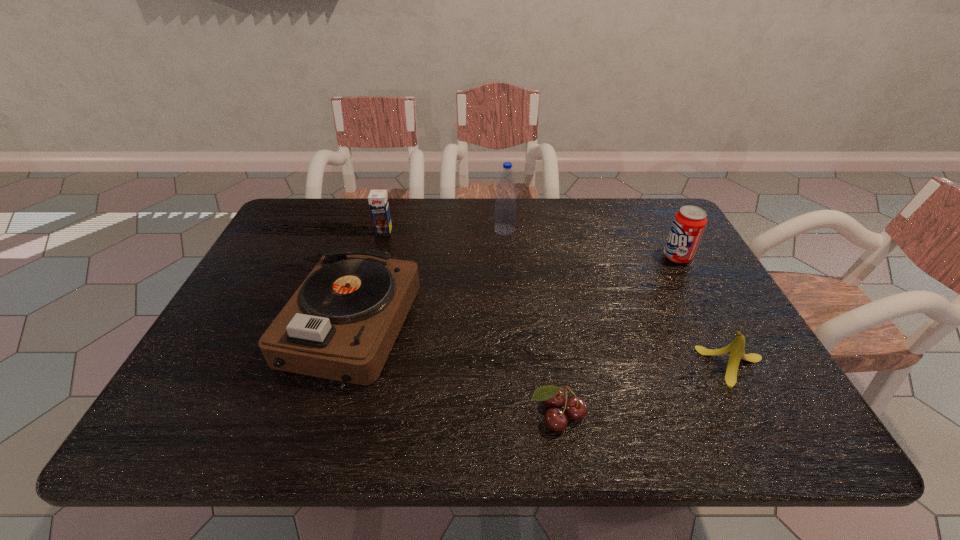
At what (x,y) coordinates should I click in order to perform the action: click on empty location between the record player and the banana. Please return your answer as a coordinate pair (x, y). Looking at the image, I should click on (543, 347).

The height and width of the screenshot is (540, 960). In order to click on free space between the banana and the third farthest object in this screenshot , I will do `click(707, 312)`.

Where is `unoccupied position between the banana and the chocolate milk`? This screenshot has height=540, width=960. unoccupied position between the banana and the chocolate milk is located at coordinates (560, 299).

Image resolution: width=960 pixels, height=540 pixels. What are the coordinates of `free space between the chocolate milk and the banana` in the screenshot? It's located at (560, 299).

Where is `the closest object relative to the water bottle`? This screenshot has height=540, width=960. the closest object relative to the water bottle is located at coordinates (341, 324).

Select which object appears as the fourth closest to the record player. Please provide its 2D coordinates. Your answer should be formatted as a tuple, i.e. [(x, y)], where the tuple contains the x and y coordinates of a point satisfying the conditions above.

[(736, 348)]

Where is `vacant space that satisfies the following two spatial constraints: 1. on the surface of the fourth nearest object; 2. on the leaves of the cherry`? vacant space that satisfies the following two spatial constraints: 1. on the surface of the fourth nearest object; 2. on the leaves of the cherry is located at coordinates (763, 415).

Where is `free space that satisfies the following two spatial constraints: 1. on the front label of the banana; 2. on the left side of the chocolate milk`? Image resolution: width=960 pixels, height=540 pixels. free space that satisfies the following two spatial constraints: 1. on the front label of the banana; 2. on the left side of the chocolate milk is located at coordinates (346, 367).

Identify the location of vacant space that satisfies the following two spatial constraints: 1. on the front label of the chocolate milk; 2. on the right side of the banana. (346, 367).